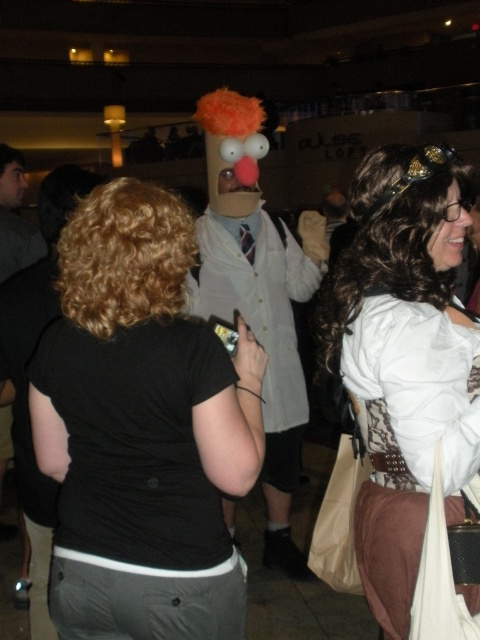
Can you confirm if black matte shirt at center is positioned above white satin dress at center?

Actually, black matte shirt at center is below white satin dress at center.

Is point (113, 493) less distant than point (396, 593)?

Yes, it is in front of point (396, 593).

This screenshot has width=480, height=640. Find the location of `black matte shirt at center`. black matte shirt at center is located at coordinates (142, 429).

Which is below, black matte shirt at center or cardboard mask at center?

black matte shirt at center

Is black matte shirt at center wider than cardboard mask at center?

No, black matte shirt at center is not wider than cardboard mask at center.

Between point (130, 566) and point (257, 173), which one is positioned in front?

Point (130, 566)

In order to click on black matte shirt at center in this screenshot , I will do `click(142, 429)`.

Measure the distance between white satin dress at center and cardboard mask at center.

white satin dress at center and cardboard mask at center are 1.28 meters apart.

Who is more distant from viewer, [328,344] or [278,513]?

The point [278,513] is behind.

Between point (446, 355) and point (310, 253), which one is positioned behind?

The point (310, 253) is more distant.

I want to click on white satin dress at center, so click(404, 356).